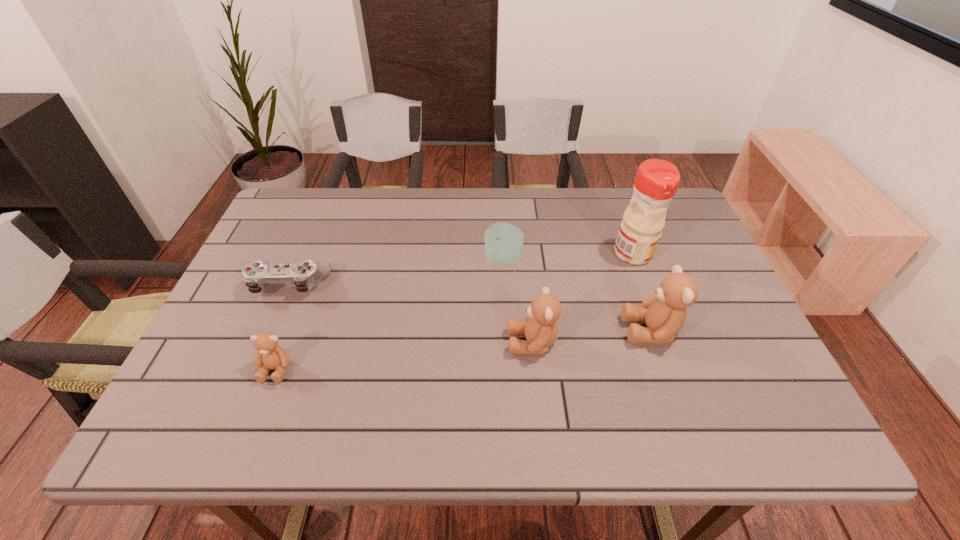
The height and width of the screenshot is (540, 960). I want to click on vacant space in between the second tallest teddy bear and the shortest object, so click(x=411, y=313).

You are a GUI agent. You are given a task and a screenshot of the screen. Output one action in this format:
    pyautogui.click(x=<x>, y=<y>)
    Task: Click on the empty location between the second shortest teddy bear and the tallest object
    
    Given the screenshot: What is the action you would take?
    pyautogui.click(x=583, y=298)

This screenshot has height=540, width=960. Identify the location of free spot between the shortest object and the second teddy bear from right to left. pyautogui.click(x=411, y=313).

You are a GUI agent. You are given a task and a screenshot of the screen. Output one action in this format:
    pyautogui.click(x=<x>, y=<y>)
    Task: Click on the empty space that is in between the apple and the fourth shortest object
    Image resolution: width=960 pixels, height=540 pixels.
    Given the screenshot: What is the action you would take?
    pyautogui.click(x=517, y=301)

Where is `free area in between the control and the apple`? Image resolution: width=960 pixels, height=540 pixels. free area in between the control and the apple is located at coordinates (396, 272).

The image size is (960, 540). Identify the location of free space between the shortest teddy bear and the rightmost teddy bear. (464, 349).

At what (x,y) coordinates should I click in order to perform the action: click on empty space that is in between the shortest object and the apple. Please return your answer as a coordinate pair (x, y). Image resolution: width=960 pixels, height=540 pixels. Looking at the image, I should click on (396, 272).

This screenshot has height=540, width=960. I want to click on vacant area that lies between the rightmost teddy bear and the condiment, so click(642, 292).

What are the coordinates of `object that is the nearest to the tallest object` in the screenshot? It's located at (664, 312).

Select which object is the closest to the leftmost teddy bear. Please provide its 2D coordinates. Your answer should be formatted as a tuple, i.e. [(x, y)], where the tuple contains the x and y coordinates of a point satisfying the conditions above.

[(304, 274)]